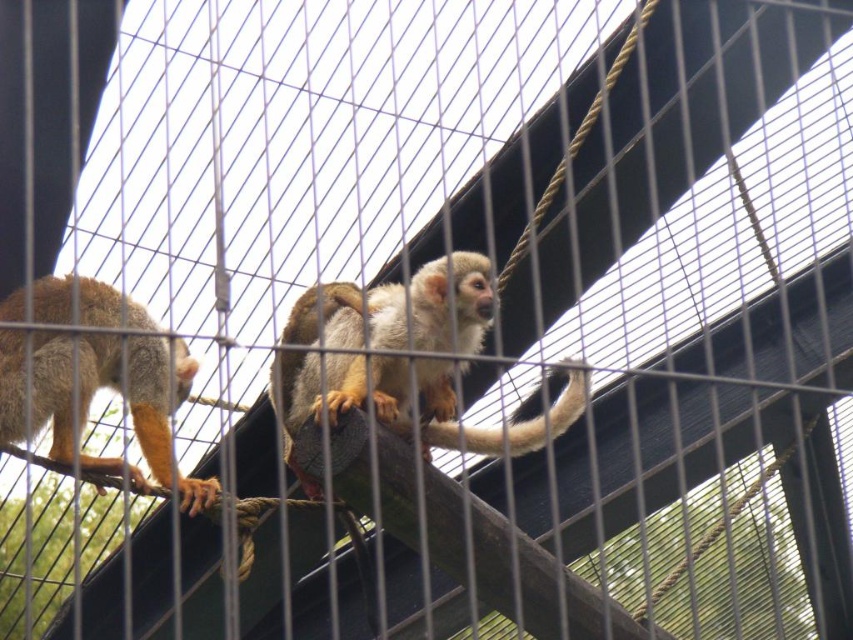
You are a zookeeper who needs to determine which monkey requires a larger feeding portion based on their size. Given the golden fur monkey at center and the brown fur monkey at left, which one should receive more food?

The golden fur monkey at center is bigger than the brown fur monkey at left, so it should receive a larger feeding portion.

You are standing in front of the zoo enclosure with the two squirrel monkeys. You want to take a photo of the point at coordinates point (x=456, y=307). Your camera has a maximum focus range of 5 meters. Will the camera be able to focus on the point?

The point (x=456, y=307) is 4.51 meters from the camera. Since the camera can focus up to 5 meters, the camera will be able to focus on the point (x=456, y=307).